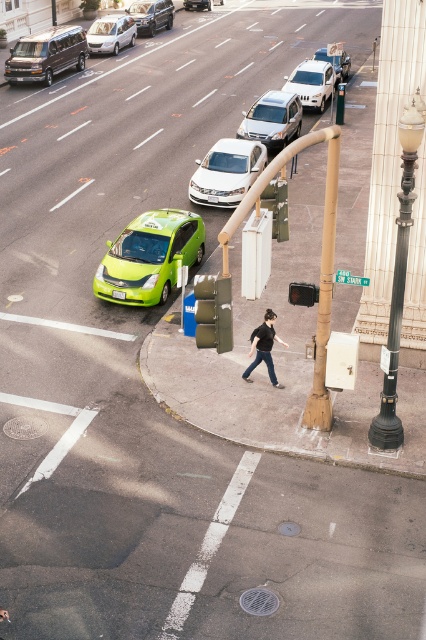
Looking at this image, you are a delivery driver who needs to park your vehicle between the black glass lamp post at right and the white matte suv at center. Can you fit your truck, which is 2 meters wide, in the space between them?

The black glass lamp post at right has a lesser width compared to white matte suv at center. However, the width of the space between them is not provided, so it is impossible to determine if the truck can fit. Please check the available space dimensions.

You are a delivery driver needing to pass through the street. You see a shiny silver sedan at upper center and a metallic silver sedan at center. Which car takes up more space on the road?

The shiny silver sedan at upper center takes up more space on the road because it is larger in size than the metallic silver sedan at center.